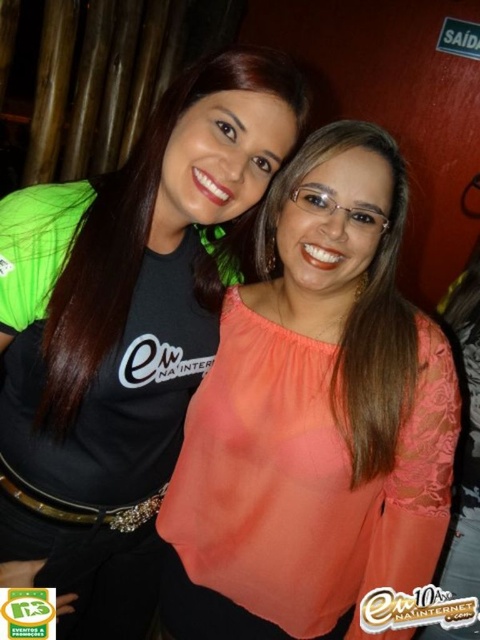
Based on the photo, you are a photographer trying to adjust the lighting for a group photo. You notice the coral lace blouse at center and the matte black shirt at left. Which clothing item is positioned to the right side of the other?

The coral lace blouse at center is to the right of the matte black shirt at left.

You are a photographer setting up a shot for two women. The woman in the matte black shirt at left is standing closer to the camera than the woman in the matte coral blouse at center. To ensure both are in focus, you need to adjust the camera settings. Which woman should you focus on to maximize the chances of both being sharp?

You should focus on the matte coral blouse at center because the matte black shirt at left is much taller as matte coral blouse at center, so focusing on the farther subject can help achieve better depth of field for both.